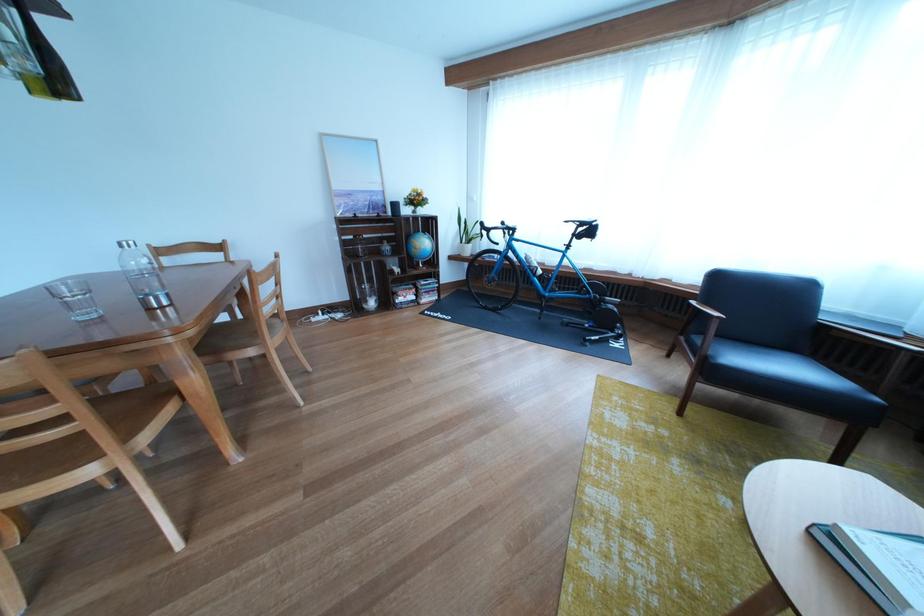
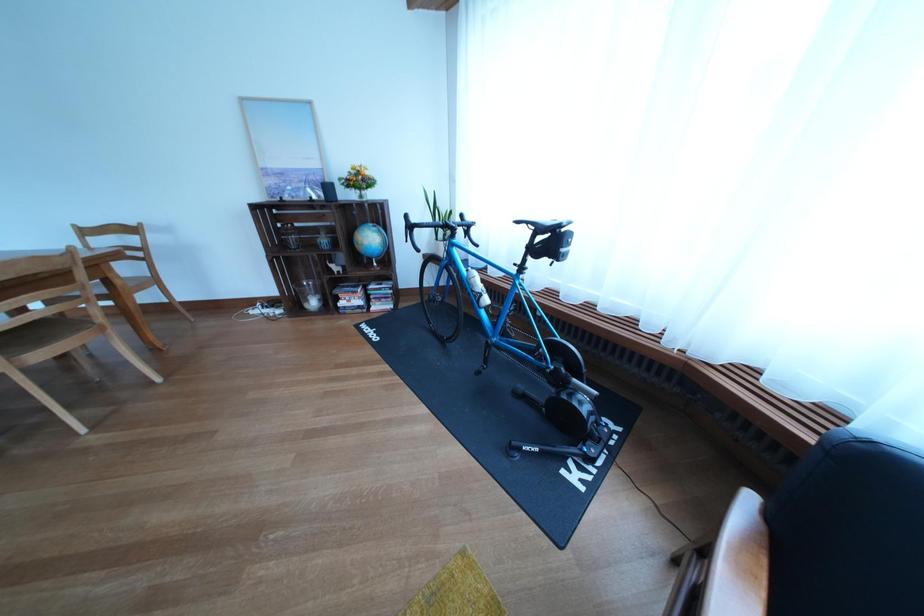
Find the pixel in the second image that matches the point at 530,262 in the first image.

(470, 277)